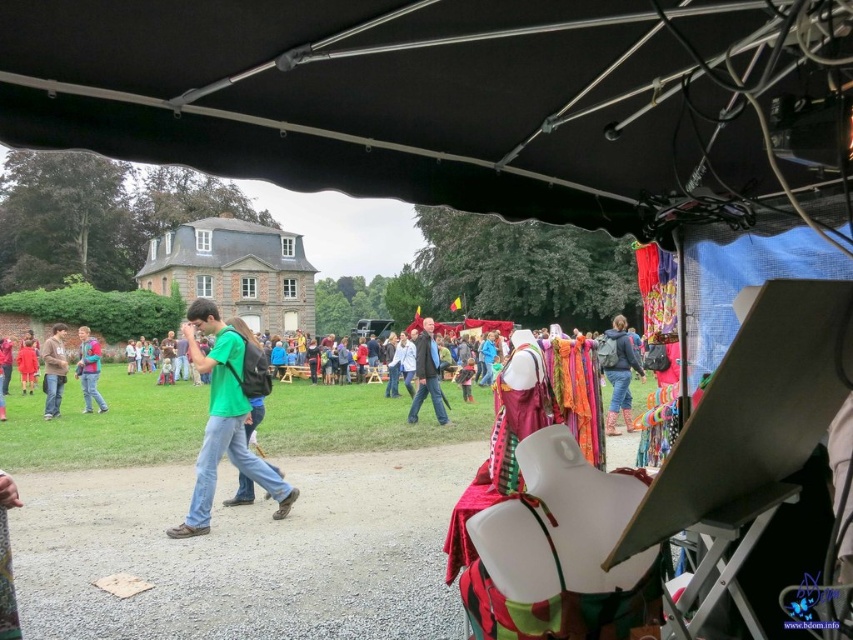
Between dark gray jacket at center and blue denim jeans at left, which one appears on the right side from the viewer's perspective?

dark gray jacket at center is more to the right.

Is point (421, 372) positioned before point (90, 342)?

Yes.

Locate an element on the screen. The width and height of the screenshot is (853, 640). dark gray jacket at center is located at coordinates (427, 374).

Does green matte shirt at center come in front of dark gray jacket at center?

Yes.

Is point (218, 380) closer to camera compared to point (434, 390)?

Yes, it is in front of point (434, 390).

At what (x,y) coordinates should I click in order to perform the action: click on green matte shirt at center. Please return your answer as a coordinate pair (x, y). Looking at the image, I should click on (223, 420).

Does black fabric canopy at upper center have a lesser height compared to dark gray jacket at center?

Indeed, black fabric canopy at upper center has a lesser height compared to dark gray jacket at center.

Who is lower down, black fabric canopy at upper center or dark gray jacket at center?

dark gray jacket at center is below.

The image size is (853, 640). Describe the element at coordinates (450, 99) in the screenshot. I see `black fabric canopy at upper center` at that location.

Identify the location of black fabric canopy at upper center. The image size is (853, 640). (450, 99).